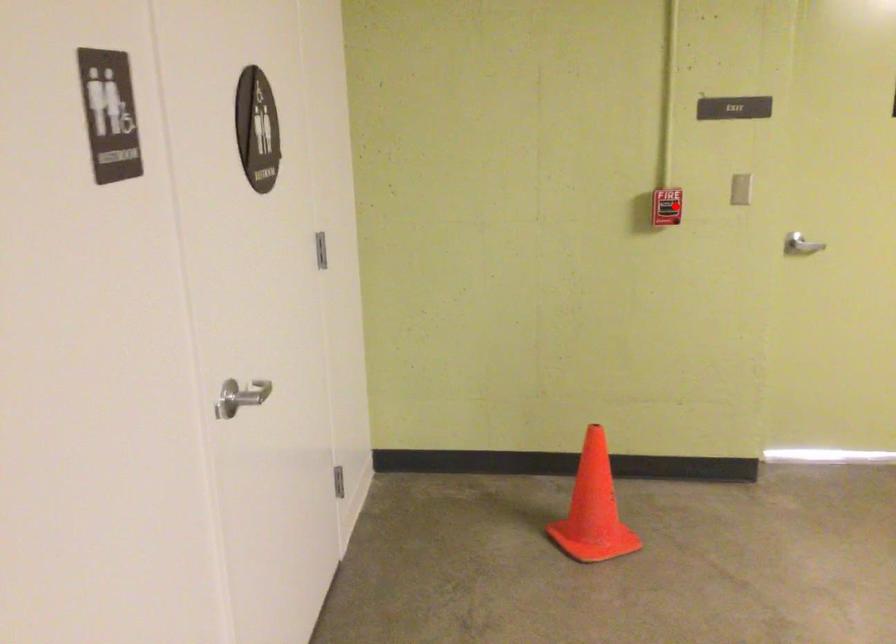
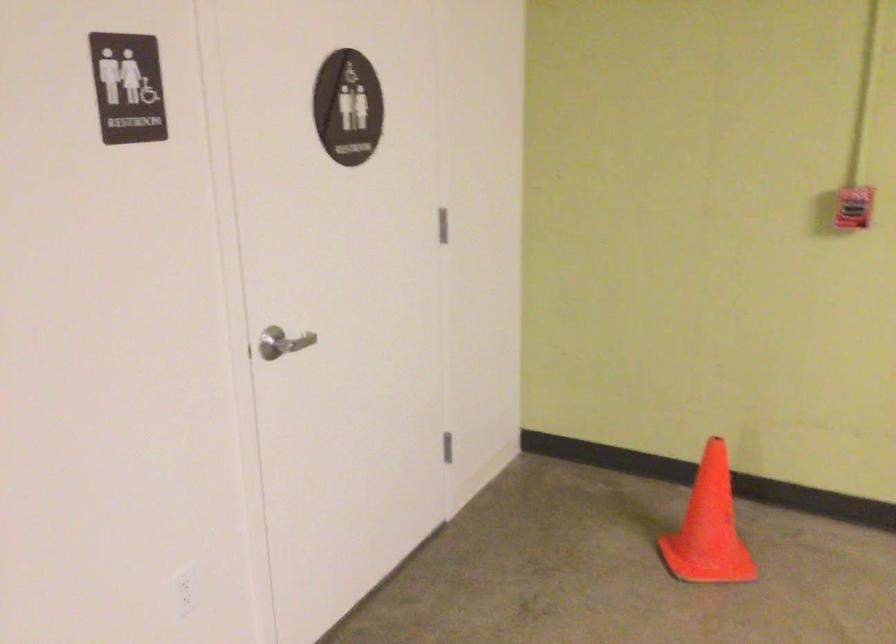
Find the pixel in the second image that matches the highlighted location in the first image.

(854, 207)